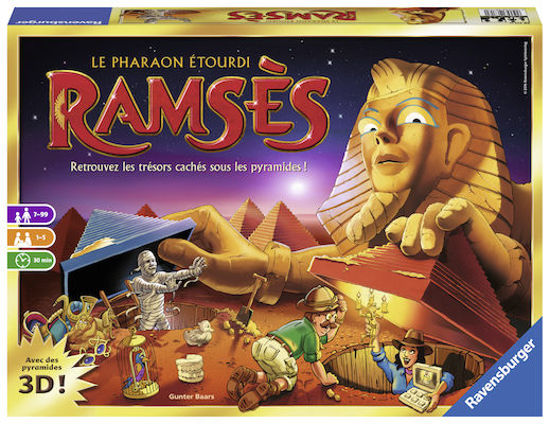
What are the coordinates of `candle` in the screenshot? It's located at (372, 312).